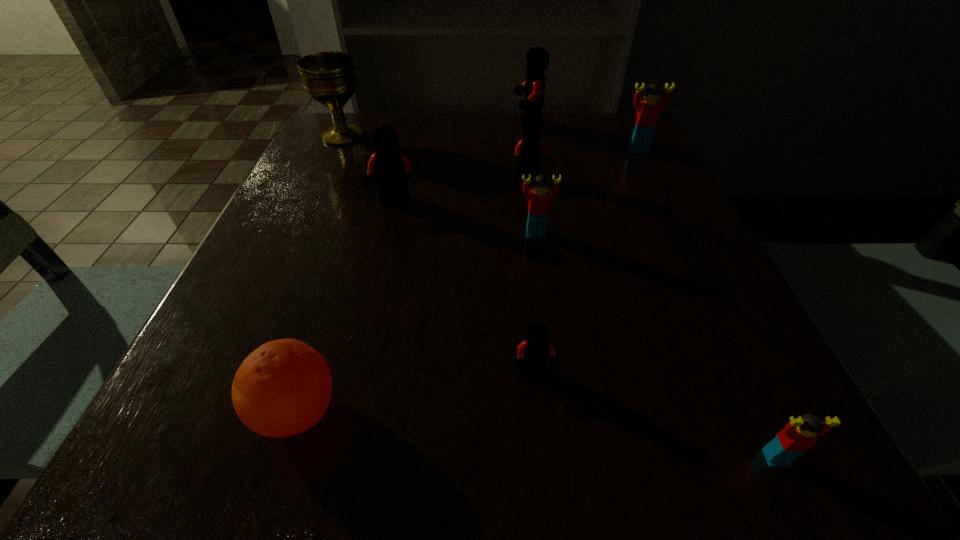
Locate an element on the screen. the third nearest black Lego is located at coordinates (529, 150).

Image resolution: width=960 pixels, height=540 pixels. In order to click on orange orange in this screenshot , I will do `click(283, 388)`.

Where is `the nearest Lego`? Image resolution: width=960 pixels, height=540 pixels. the nearest Lego is located at coordinates (798, 436).

Find the location of a particular element. The image size is (960, 540). the smallest red Lego is located at coordinates (798, 436).

Identify the location of the smallest black Lego. (534, 352).

Identify the location of the nearest black Lego. (534, 352).

At what (x,y) coordinates should I click in order to perform the action: click on free spot located 0.350m on the front-facing side of the biggest black Lego. Please return your answer as a coordinate pair (x, y). The height and width of the screenshot is (540, 960). Looking at the image, I should click on (372, 125).

Where is `blank area located on the front-facing side of the biggest black Lego`? The image size is (960, 540). blank area located on the front-facing side of the biggest black Lego is located at coordinates (493, 125).

The image size is (960, 540). What are the coordinates of `free region located on the front-facing side of the biggest black Lego` in the screenshot? It's located at (448, 125).

Locate an element on the screen. vacant space located 0.200m on the right of the chalice is located at coordinates (451, 136).